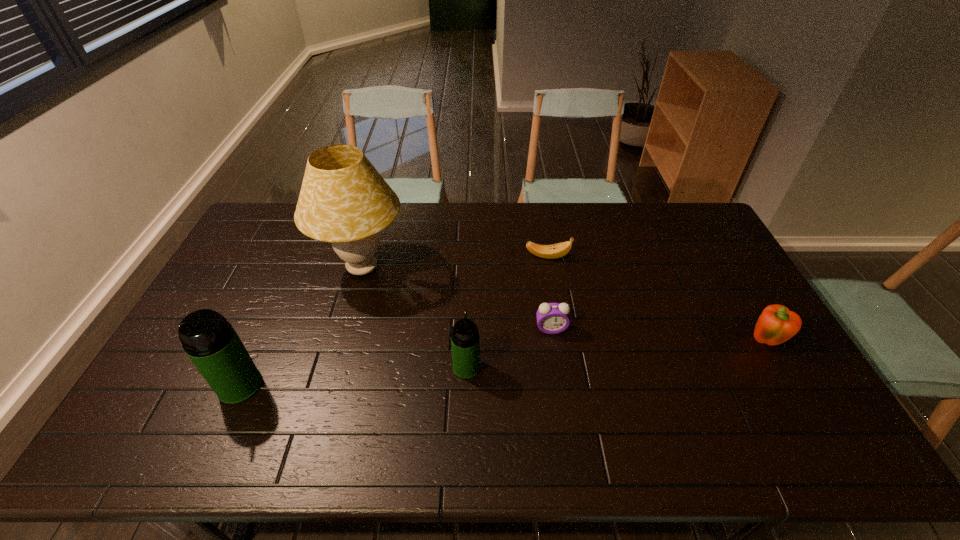
Locate an element on the screen. blank region between the alarm clock and the rightmost object is located at coordinates (658, 335).

Locate an element on the screen. vacant space in between the alarm clock and the banana is located at coordinates (549, 293).

This screenshot has width=960, height=540. Find the location of `unoccupied area between the fourth object from right to left and the alarm clock`. unoccupied area between the fourth object from right to left and the alarm clock is located at coordinates (509, 348).

The image size is (960, 540). Identify the location of free space that is in between the tallest object and the banana. (455, 262).

Locate an element on the screen. The image size is (960, 540). empty space between the alarm clock and the fifth shortest object is located at coordinates (396, 357).

Identify the location of the second closest object to the leftmost object. pos(465,341).

Image resolution: width=960 pixels, height=540 pixels. What are the coordinates of `object that can be found as the third closest to the alarm clock` in the screenshot? It's located at (344, 200).

This screenshot has width=960, height=540. Identify the location of vacant space that satisfies the following two spatial constraints: 1. from the spout of the right thermos bottle; 2. on the right side of the banana. (469, 256).

This screenshot has width=960, height=540. I want to click on blank space that satisfies the following two spatial constraints: 1. from the spout of the third shortest object; 2. on the right side of the right thermos bottle, so click(467, 342).